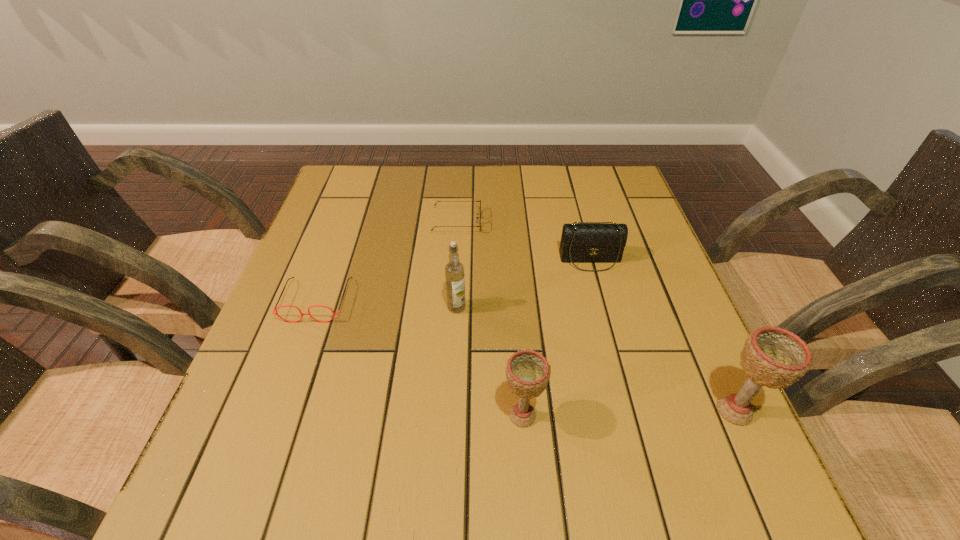
Identify the location of free space between the vodka and the right chalice. The width and height of the screenshot is (960, 540). (595, 359).

Locate an element on the screen. The image size is (960, 540). blank region between the sunglasses and the spectacles is located at coordinates (387, 261).

Identify the location of free space between the sunglasses and the clutch bag. (523, 241).

You are a GUI agent. You are given a task and a screenshot of the screen. Output one action in this format:
    pyautogui.click(x=<x>, y=<y>)
    Task: Click on the empty space between the vodka and the right chalice
    This screenshot has height=540, width=960.
    Given the screenshot: What is the action you would take?
    pyautogui.click(x=595, y=359)

I want to click on free spot between the vodka and the third object from right to left, so 490,361.

Image resolution: width=960 pixels, height=540 pixels. I want to click on free space between the sunglasses and the leftmost object, so click(387, 261).

This screenshot has width=960, height=540. Identify the location of the third closest object relative to the vodka. (477, 218).

Identify which object is the second nearest to the fifth nearest object. Please provide its 2D coordinates. Your answer should be formatted as a tuple, i.e. [(x, y)], where the tuple contains the x and y coordinates of a point satisfying the conditions above.

[(454, 270)]

Find the location of a particular element. The image size is (960, 540). free location that satisfies the following two spatial constraints: 1. on the front-facing side of the shortest object; 2. on the right side of the shorter chalice is located at coordinates (445, 415).

Where is `free space that satisfies the following two spatial constraints: 1. on the front-facing side of the farthest object; 2. on the front-facing side of the spectacles`? free space that satisfies the following two spatial constraints: 1. on the front-facing side of the farthest object; 2. on the front-facing side of the spectacles is located at coordinates click(x=452, y=300).